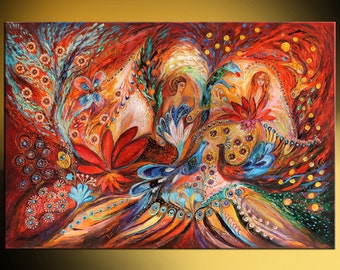
Where is `yellow background wall`? This screenshot has width=340, height=270. yellow background wall is located at coordinates (159, 265).